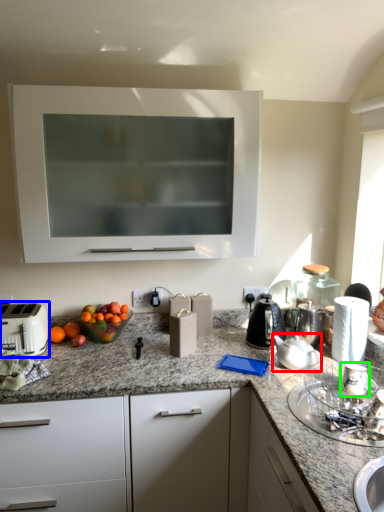
Question: Which object is the closest to the tea pot (highlighted by a red box)? Choose among these: toaster (highlighted by a blue box) or appliance (highlighted by a green box).

Choices:
 (A) toaster
 (B) appliance

Answer: (B)